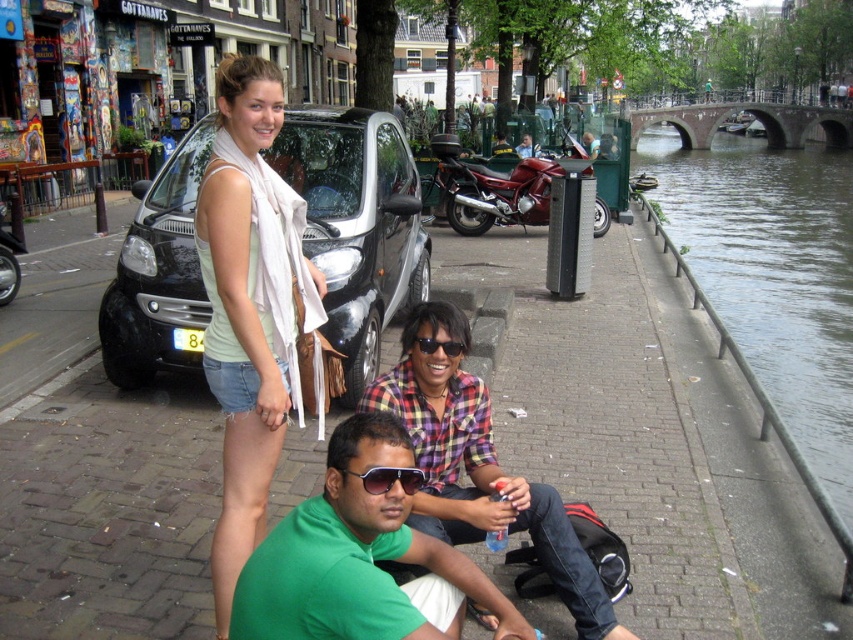
You are a delivery person with a package that needs to be placed between the black metallic car at center and the plaid shirt at center. The package is 1.2 meters wide. Can it fit in the space between them?

The black metallic car at center might be wider than plaid shirt at center, so the space between them may not be wide enough to accommodate the 1.2 meter package. Check the actual width before placing it.

You are a photographer trying to capture a candid shot of the two seated individuals. Since the green matte shirt at lower center is blocking the view of the black plastic sunglasses at center, can you adjust your position to get a clear shot of both without moving the subjects?

The green matte shirt at lower center is in front of the black plastic sunglasses at center, so moving your position slightly to the side might allow you to see around the obstruction and capture both subjects clearly.